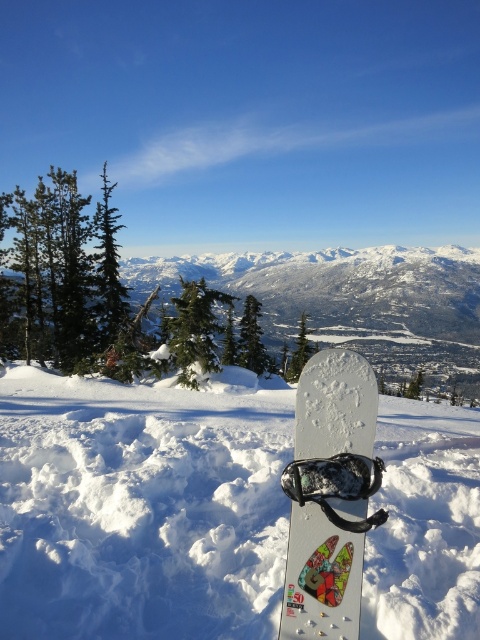
You are an observer standing in the winter landscape scene. You notice the snowy white mountain at center and the white glossy snowboard at center. Which object appears wider from your viewpoint?

The snowy white mountain at center appears wider than the white glossy snowboard at center because its width surpasses the snowboard.

You are standing in a winter landscape with a snowboard partially buried in the snow. You want to know the exact location of the snowy white mountain at center. What are its coordinates?

The snowy white mountain at center is located at coordinates point [336,288].